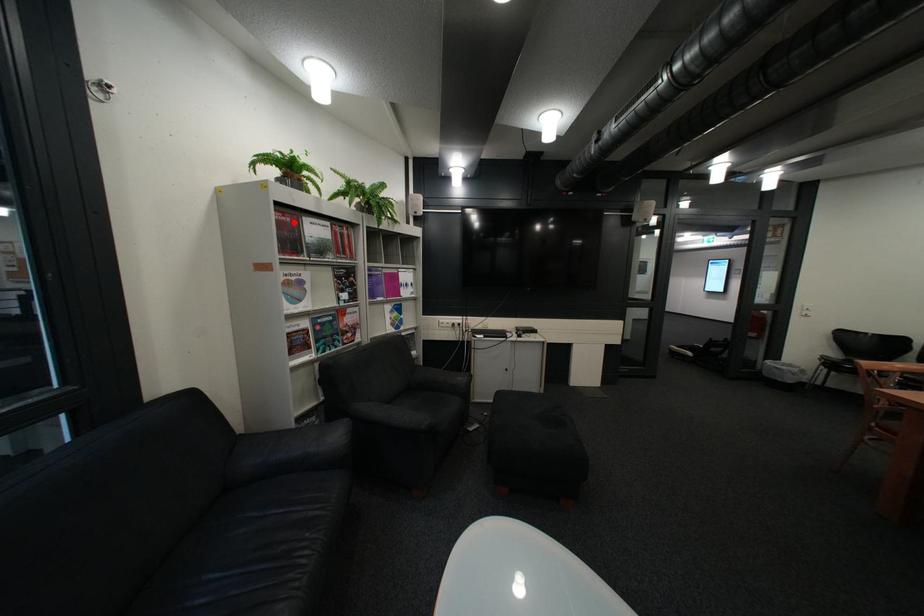
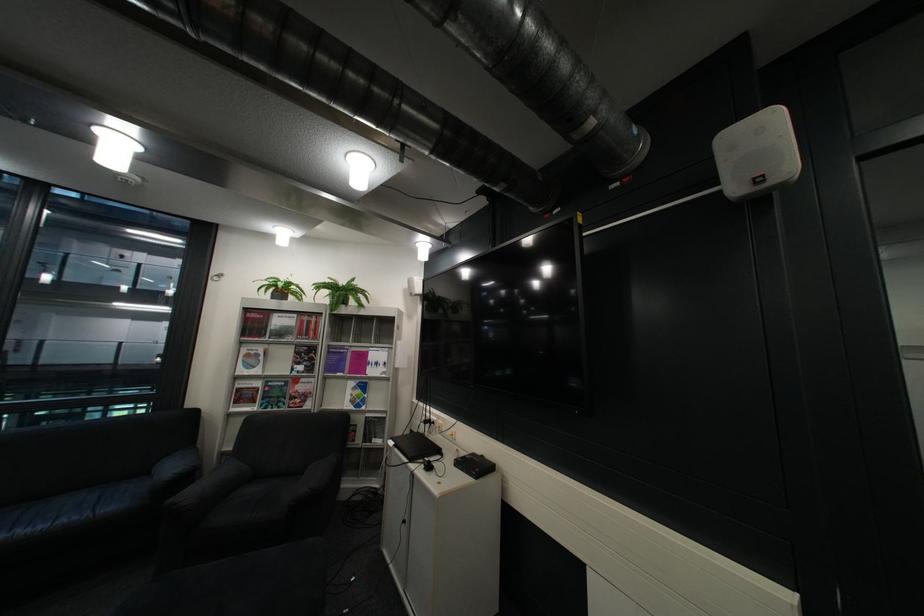
Find the pixel in the second image that matches the highlighted location in the first image.

(260, 320)